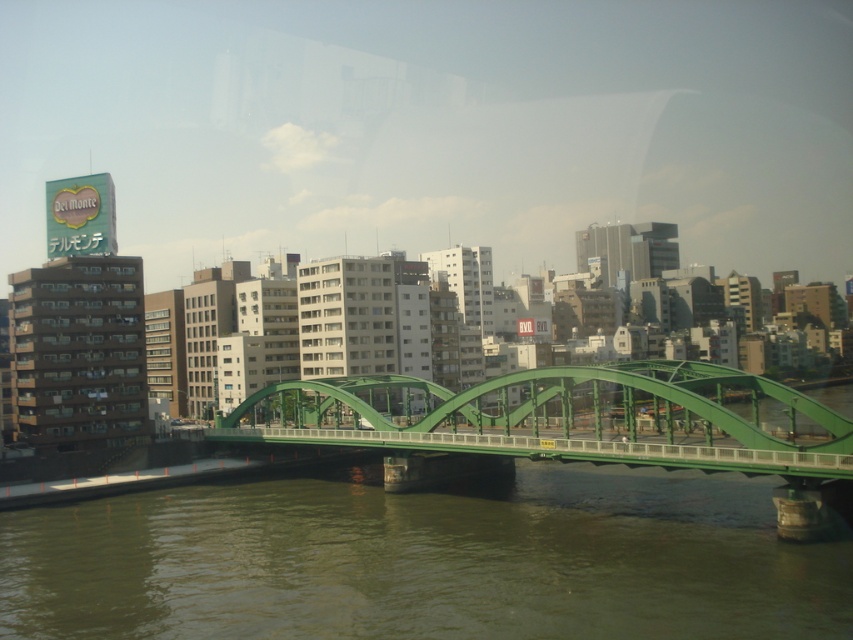
Question: Can you confirm if green concrete river at center is smaller than green metallic bridge at center?

Choices:
 (A) yes
 (B) no

Answer: (A)

Question: Observing the image, what is the correct spatial positioning of green concrete river at center in reference to green metallic bridge at center?

Choices:
 (A) left
 (B) right

Answer: (A)

Question: Which object appears closest to the camera in this image?

Choices:
 (A) green metallic bridge at center
 (B) green concrete river at center

Answer: (B)

Question: Does green concrete river at center come behind green metallic bridge at center?

Choices:
 (A) no
 (B) yes

Answer: (A)

Question: Which point is farther to the camera?

Choices:
 (A) green metallic bridge at center
 (B) green concrete river at center

Answer: (A)

Question: Which point is farther to the camera?

Choices:
 (A) (779, 536)
 (B) (471, 588)

Answer: (A)